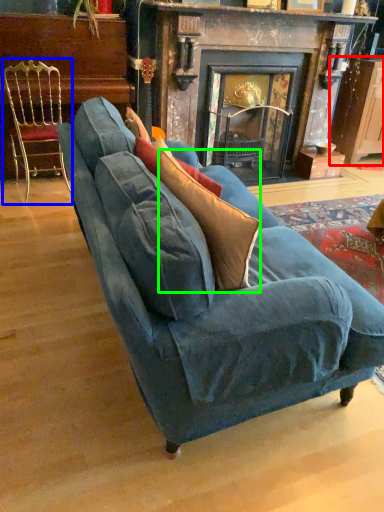
Question: Which object is positioned closest to cabinetry (highlighted by a red box)? Select from chair (highlighted by a blue box) and throw pillow (highlighted by a green box).

Choices:
 (A) chair
 (B) throw pillow

Answer: (A)